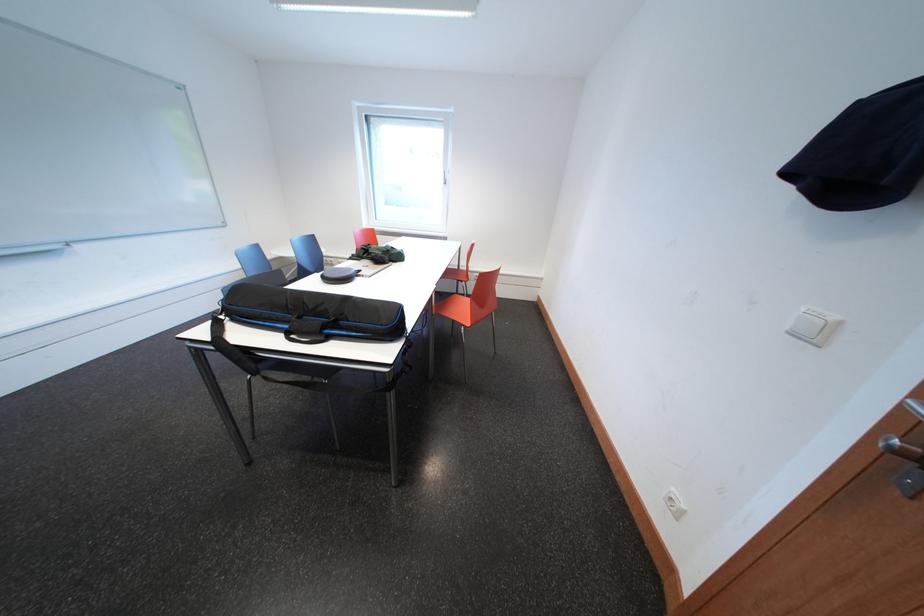
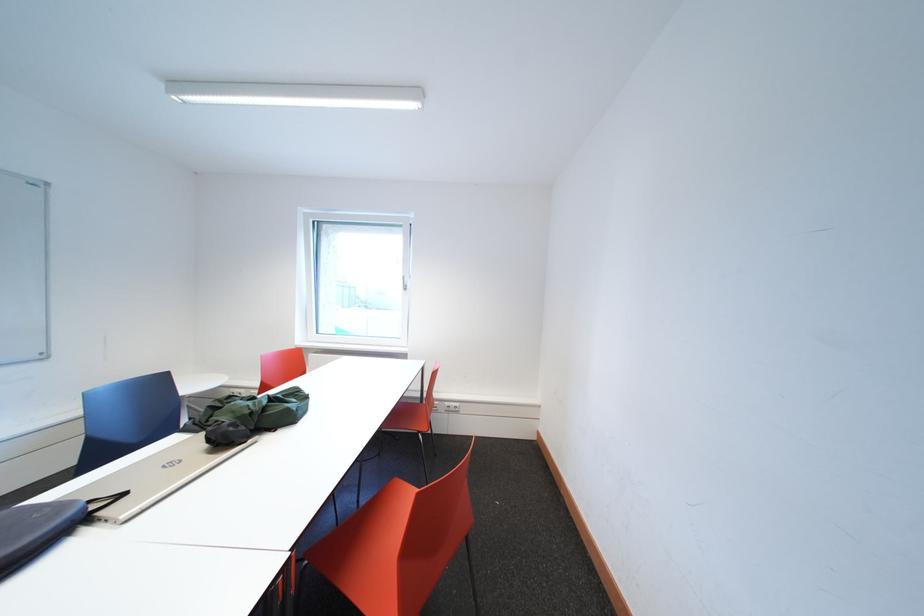
Question: The images are taken continuously from a first-person perspective. In which direction is your viewpoint rotating?

Choices:
 (A) Left
 (B) Right
 (C) Up
 (D) Down

Answer: (C)